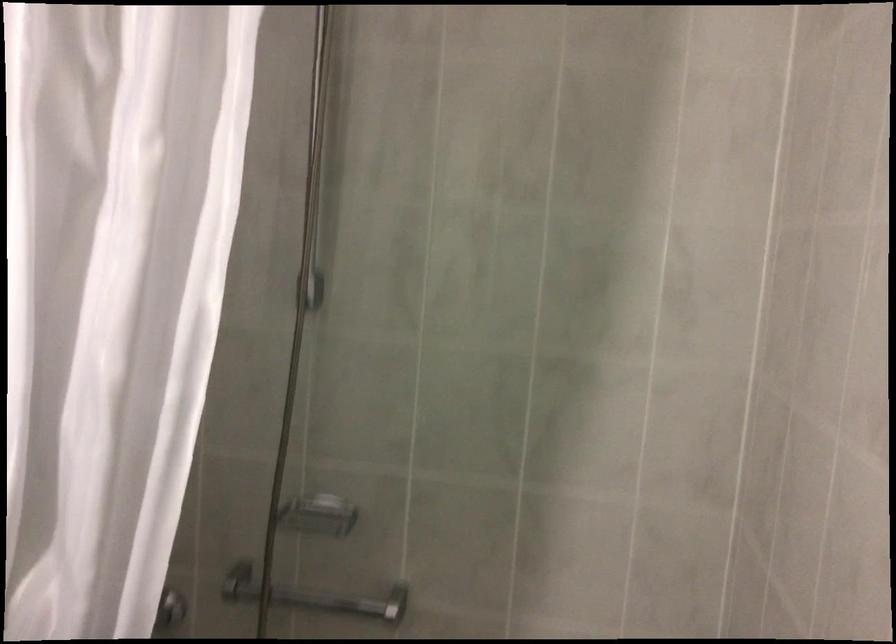
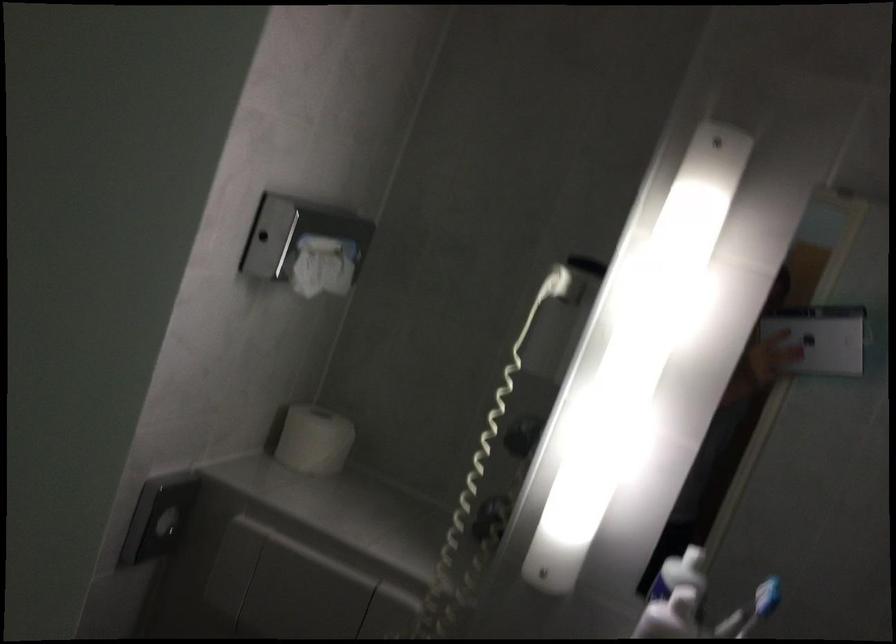
Question: The first image is from the beginning of the video and the second image is from the end. How did the camera likely rotate when shooting the video?

Choices:
 (A) Left
 (B) Right
 (C) Up
 (D) Down

Answer: (A)